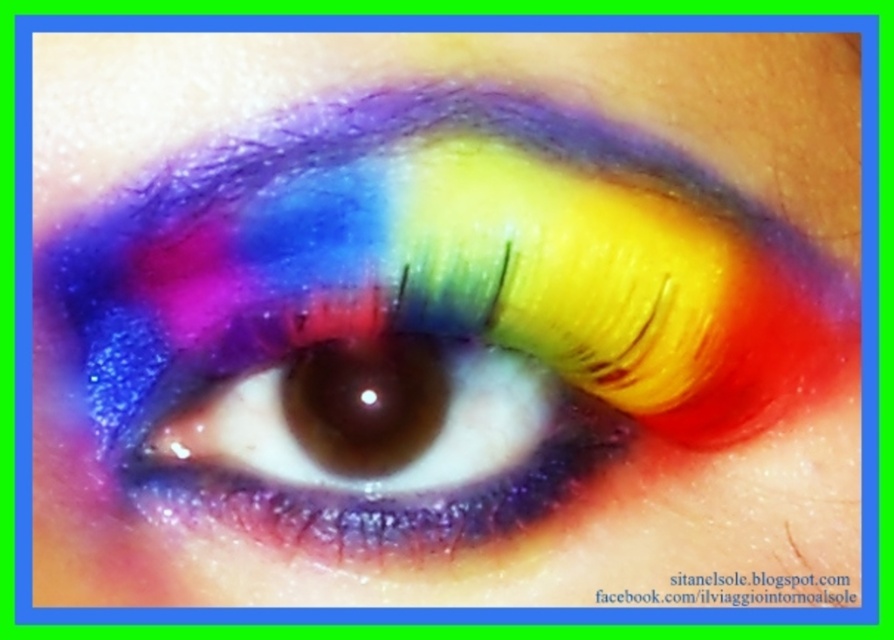
Who is positioned more to the left, shimmering rainbow eye at center or shiny rainbow eye at center?

From the viewer's perspective, shiny rainbow eye at center appears more on the left side.

Image resolution: width=894 pixels, height=640 pixels. In order to click on shimmering rainbow eye at center in this screenshot , I will do `click(443, 294)`.

Find the location of a particular element. shimmering rainbow eye at center is located at coordinates (443, 294).

Where is `shimmering rainbow eye at center`? The image size is (894, 640). shimmering rainbow eye at center is located at coordinates (443, 294).